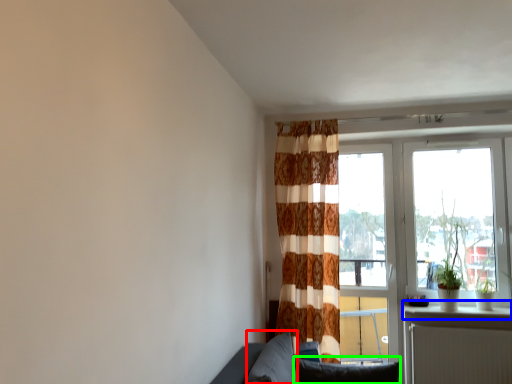
Question: Considering the real-world distances, which object is farthest from pillow (highlighted by a red box)? window sill (highlighted by a blue box) or pillow (highlighted by a green box)?

Choices:
 (A) window sill
 (B) pillow

Answer: (A)